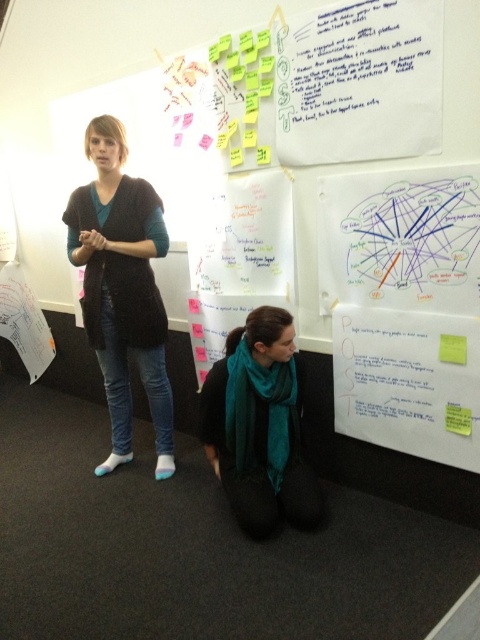
Where is the teal scarf at lower center located in the image?

The teal scarf at lower center is located at point 0.667 on the x axis and 0.542 on the y axis.

You are organizing a presentation and need to place both the white paper at upper center and the teal scarf at lower center on a display board. Which object should you place first if you want to ensure the larger item is positioned below the smaller one?

You should place the white paper at upper center first because it is smaller than the teal scarf at lower center, allowing the larger teal scarf at lower center to be positioned below it.

You are an office assistant who needs to hang a picture frame that is 30 cm tall on the whiteboard. The teal scarf at lower center and the yellow sticky note at upper right are already on the whiteboard. Can you fit the picture frame between them?

The teal scarf at lower center is much taller than the yellow sticky note at upper right. Since the picture frame is 30 cm tall, it can be placed between them as there is sufficient vertical space between the two objects on the whiteboard.